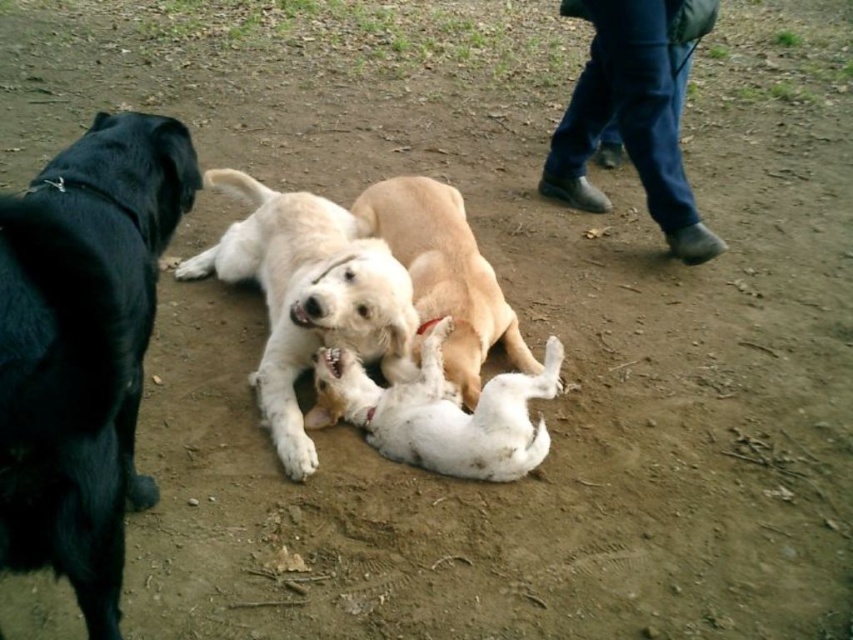
Between white fur dog at center and white soft fur dog at center, which one appears on the left side from the viewer's perspective?

From the viewer's perspective, white fur dog at center appears more on the left side.

Is white fur dog at center above white soft fur dog at center?

Indeed, white fur dog at center is positioned over white soft fur dog at center.

Who is more forward, (357, 330) or (511, 376)?

Point (511, 376) is more forward.

Where is `white fur dog at center`? This screenshot has height=640, width=853. white fur dog at center is located at coordinates (308, 298).

Does shiny black dog at left appear on the right side of light brown fur at center?

In fact, shiny black dog at left is to the left of light brown fur at center.

Is shiny black dog at left smaller than light brown fur at center?

Actually, shiny black dog at left might be larger than light brown fur at center.

Is point (126, 424) in front of point (471, 307)?

That is True.

Where is `shiny black dog at left`? shiny black dog at left is located at coordinates (83, 348).

Measure the distance from white fur dog at center to light brown fur at center.

white fur dog at center is 11.26 inches away from light brown fur at center.

Is point (302, 262) positioned after point (482, 257)?

That is False.

Who is more forward, [386,355] or [425,330]?

Point [386,355] is more forward.

You are a GUI agent. You are given a task and a screenshot of the screen. Output one action in this format:
    pyautogui.click(x=<x>, y=<y>)
    Task: Click on the white fur dog at center
    The height and width of the screenshot is (640, 853).
    Given the screenshot: What is the action you would take?
    pyautogui.click(x=308, y=298)